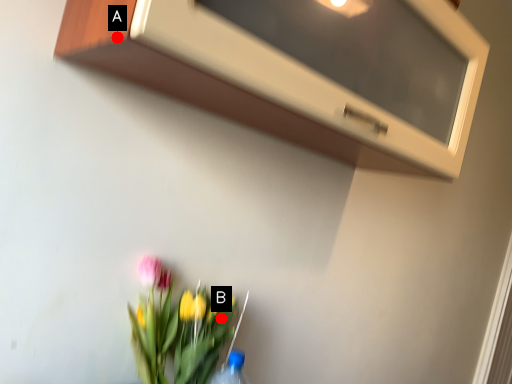
Question: Two points are circled on the image, labeled by A and B beside each circle. Which point appears farthest from the camera in this image?

Choices:
 (A) A is further
 (B) B is further

Answer: (B)